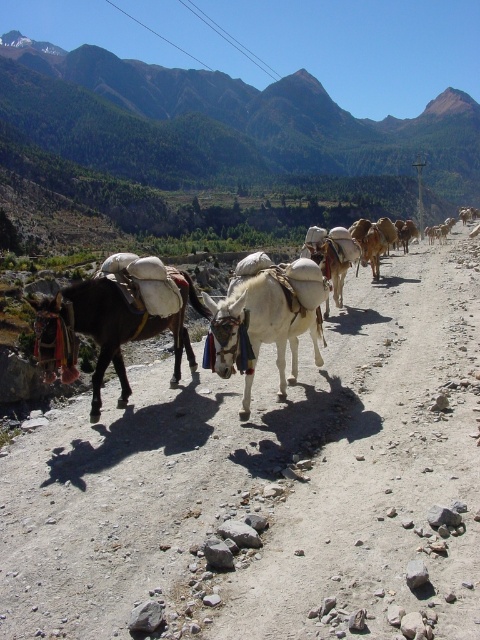
Question: Which is farther from the brown leather saddlebags at left?

Choices:
 (A) dark brown leather mule at left
 (B) green grassy mountain at upper center
 (C) dirt track at center
 (D) white soft donkey at center

Answer: (B)

Question: Can you confirm if dirt track at center is positioned to the left of green grassy mountain at upper center?

Choices:
 (A) yes
 (B) no

Answer: (B)

Question: Is green grassy mountain at upper center to the left of white soft donkey at center from the viewer's perspective?

Choices:
 (A) yes
 (B) no

Answer: (A)

Question: In this image, where is brown leather saddlebags at left located relative to dark brown leather mule at left?

Choices:
 (A) above
 (B) below

Answer: (A)

Question: Which point appears closest to the camera in this image?

Choices:
 (A) (245, 582)
 (B) (144, 67)
 (C) (316, 268)

Answer: (A)

Question: Which of these objects is positioned closest to the green grassy mountain at upper center?

Choices:
 (A) brown leather saddlebags at left
 (B) white soft donkey at center
 (C) dark brown leather mule at left
 (D) dirt track at center

Answer: (A)